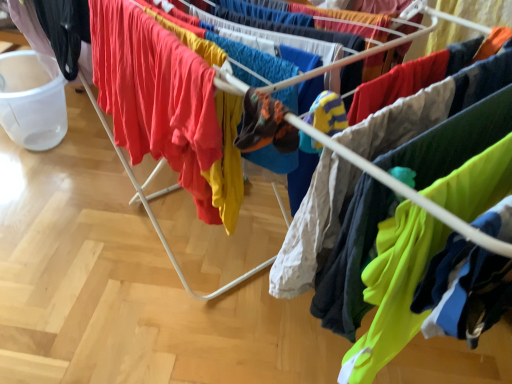
Question: Is neon green fabric at lower right, which is the 1th clothing in right-to-left order, positioned in front of matte red t-shirt at center, which appears as the 2th clothing when viewed from the left?

Choices:
 (A) yes
 (B) no

Answer: (A)

Question: Is neon green fabric at lower right, which is the 1th clothing in right-to-left order, wider than matte red t-shirt at center, which ranks as the second clothing in right-to-left order?

Choices:
 (A) yes
 (B) no

Answer: (B)

Question: Is neon green fabric at lower right, which is the 1th clothing in right-to-left order, to the left of matte red t-shirt at center, which appears as the 2th clothing when viewed from the left, from the viewer's perspective?

Choices:
 (A) no
 (B) yes

Answer: (A)

Question: Can you confirm if neon green fabric at lower right, which is the 1th clothing in right-to-left order, is bigger than matte red t-shirt at center, which appears as the 2th clothing when viewed from the left?

Choices:
 (A) yes
 (B) no

Answer: (B)

Question: Does neon green fabric at lower right, the 3th clothing in the left-to-right sequence, appear on the right side of matte red t-shirt at center, which appears as the 2th clothing when viewed from the left?

Choices:
 (A) no
 (B) yes

Answer: (B)

Question: Do you think black matte pants at left, which is counted as the first clothing, starting from the left, is within matte red t-shirt at center, which appears as the 2th clothing when viewed from the left, or outside of it?

Choices:
 (A) inside
 (B) outside

Answer: (B)

Question: Is point (67, 77) closer or farther from the camera than point (200, 147)?

Choices:
 (A) closer
 (B) farther

Answer: (B)

Question: Relative to matte red t-shirt at center, which ranks as the second clothing in right-to-left order, is black matte pants at left, which is counted as the first clothing, starting from the left, in front or behind?

Choices:
 (A) front
 (B) behind

Answer: (B)

Question: In terms of height, does black matte pants at left, placed as the third clothing when sorted from right to left, look taller or shorter compared to matte red t-shirt at center, which ranks as the second clothing in right-to-left order?

Choices:
 (A) tall
 (B) short

Answer: (B)

Question: Looking at their shapes, would you say matte red t-shirt at center, which ranks as the second clothing in right-to-left order, is wider or thinner than neon green fabric at lower right, the 3th clothing in the left-to-right sequence?

Choices:
 (A) thin
 (B) wide

Answer: (B)

Question: From the image's perspective, is matte red t-shirt at center, which appears as the 2th clothing when viewed from the left, above or below neon green fabric at lower right, which is the 1th clothing in right-to-left order?

Choices:
 (A) below
 (B) above

Answer: (B)

Question: Based on their sizes in the image, would you say matte red t-shirt at center, which ranks as the second clothing in right-to-left order, is bigger or smaller than neon green fabric at lower right, which is the 1th clothing in right-to-left order?

Choices:
 (A) small
 (B) big

Answer: (B)

Question: Considering the positions of point (187, 129) and point (490, 271), is point (187, 129) closer or farther from the camera than point (490, 271)?

Choices:
 (A) closer
 (B) farther

Answer: (B)

Question: Is point (430, 284) positioned closer to the camera than point (48, 18)?

Choices:
 (A) farther
 (B) closer

Answer: (B)

Question: Visually, is neon green fabric at lower right, which is the 1th clothing in right-to-left order, positioned to the left or to the right of black matte pants at left, which is counted as the first clothing, starting from the left?

Choices:
 (A) right
 (B) left

Answer: (A)